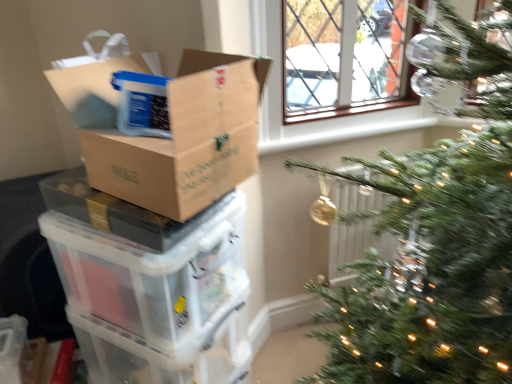
Question: Could white plastic radiator at center-right be considered to be inside transparent plastic storage box at lower left?

Choices:
 (A) yes
 (B) no

Answer: (B)

Question: Is transparent plastic storage box at lower left behind white plastic radiator at center-right?

Choices:
 (A) yes
 (B) no

Answer: (B)

Question: From a real-world perspective, is transparent plastic storage box at lower left on white plastic radiator at center-right?

Choices:
 (A) no
 (B) yes

Answer: (A)

Question: Is transparent plastic storage box at lower left looking in the opposite direction of white plastic radiator at center-right?

Choices:
 (A) no
 (B) yes

Answer: (A)

Question: Is transparent plastic storage box at lower left outside white plastic radiator at center-right?

Choices:
 (A) no
 (B) yes

Answer: (B)

Question: Does point click(110, 130) appear closer or farther from the camera than point click(351, 230)?

Choices:
 (A) closer
 (B) farther

Answer: (A)

Question: From the image's perspective, is brown cardboard box at left above or below white plastic radiator at center-right?

Choices:
 (A) below
 (B) above

Answer: (B)

Question: Considering the positions of brown cardboard box at left and white plastic radiator at center-right in the image, is brown cardboard box at left wider or thinner than white plastic radiator at center-right?

Choices:
 (A) thin
 (B) wide

Answer: (B)

Question: In terms of size, does brown cardboard box at left appear bigger or smaller than white plastic radiator at center-right?

Choices:
 (A) big
 (B) small

Answer: (A)

Question: From the image's perspective, is translucent plastic storage box at left positioned above or below transparent plastic storage box at lower left?

Choices:
 (A) above
 (B) below

Answer: (A)

Question: Considering the positions of translucent plastic storage box at left and transparent plastic storage box at lower left in the image, is translucent plastic storage box at left bigger or smaller than transparent plastic storage box at lower left?

Choices:
 (A) big
 (B) small

Answer: (A)

Question: Considering their positions, is translucent plastic storage box at left located in front of or behind transparent plastic storage box at lower left?

Choices:
 (A) front
 (B) behind

Answer: (A)

Question: Is point (218, 296) positioned closer to the camera than point (138, 372)?

Choices:
 (A) closer
 (B) farther

Answer: (B)

Question: Based on their positions, is brown cardboard box at left located to the left or right of transparent plastic storage box at lower left?

Choices:
 (A) left
 (B) right

Answer: (B)

Question: From a real-world perspective, is brown cardboard box at left positioned above or below transparent plastic storage box at lower left?

Choices:
 (A) below
 (B) above

Answer: (B)